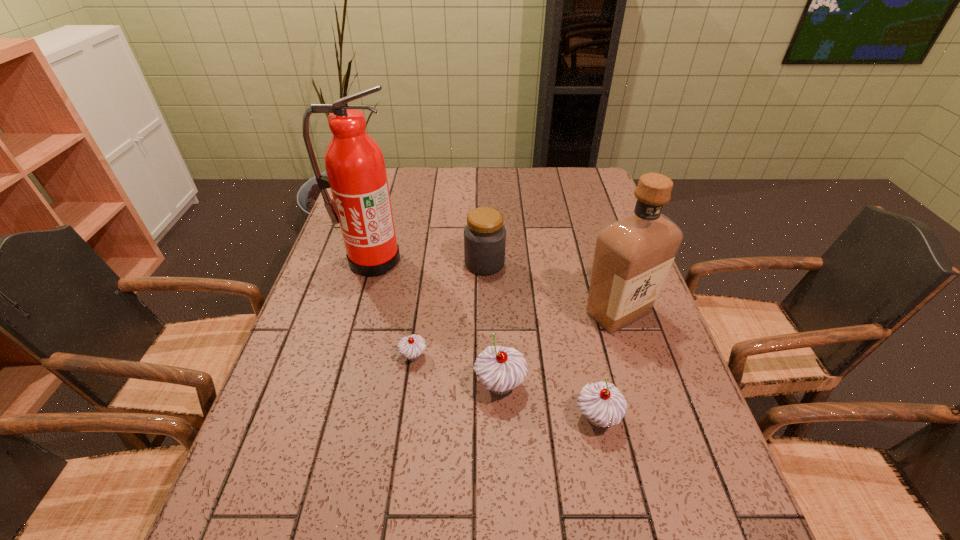
Find the location of a particular element. free space that satisfies the following two spatial constraints: 1. on the label side of the second shortest cupcake; 2. on the left side of the leftmost object is located at coordinates (327, 417).

In order to click on vacant space that satisfies the following two spatial constraints: 1. on the surface of the jar near the warning symbol; 2. on the right side of the second cupcake from right to left in this screenshot , I will do `click(486, 385)`.

I want to click on free spot that satisfies the following two spatial constraints: 1. on the surface of the jar near the warning symbol; 2. on the front side of the fifth object from right to left, so click(486, 356).